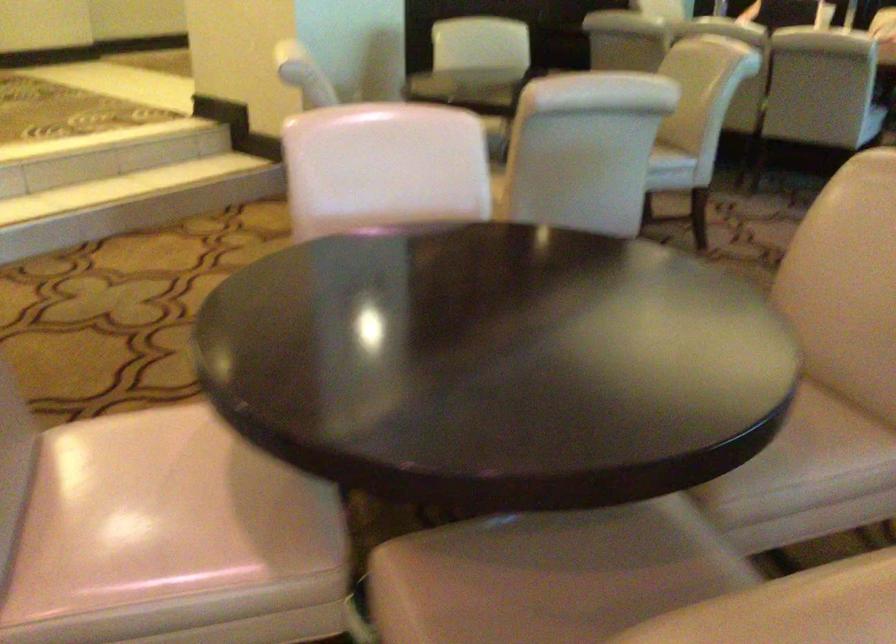
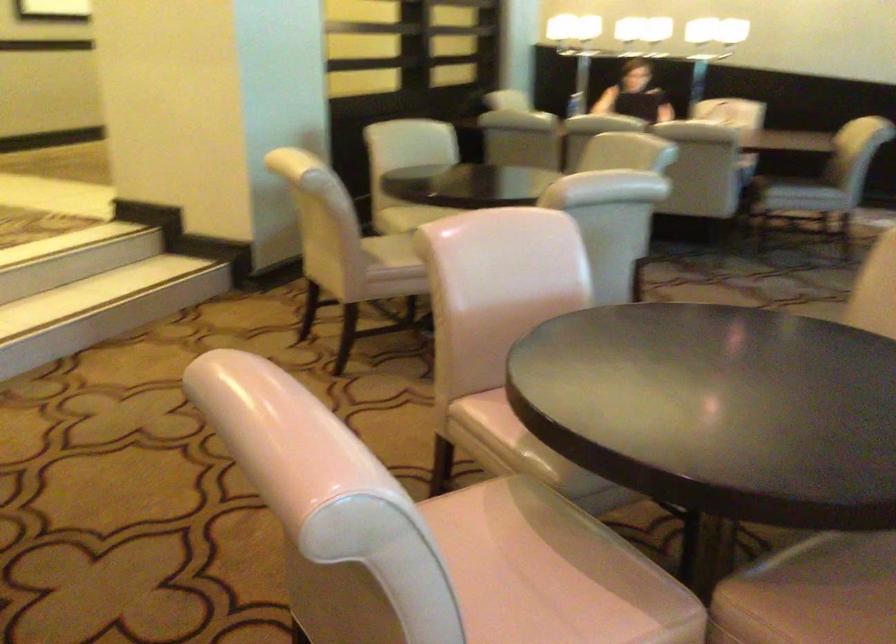
Question: The camera is either moving clockwise (left) or counter-clockwise (right) around the object. The first image is from the beginning of the video and the second image is from the end. Is the camera moving left or right when shooting the video?

Choices:
 (A) Left
 (B) Right

Answer: (A)